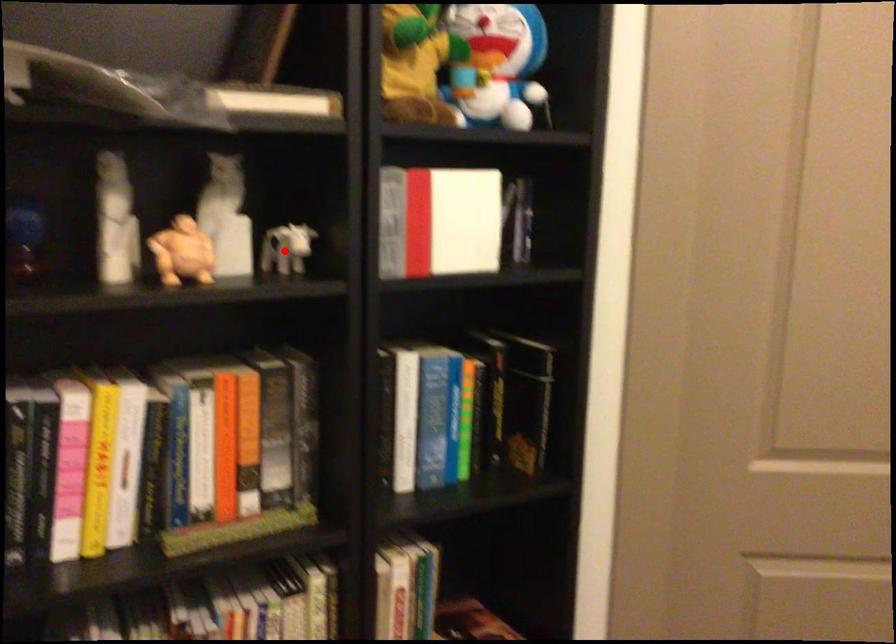
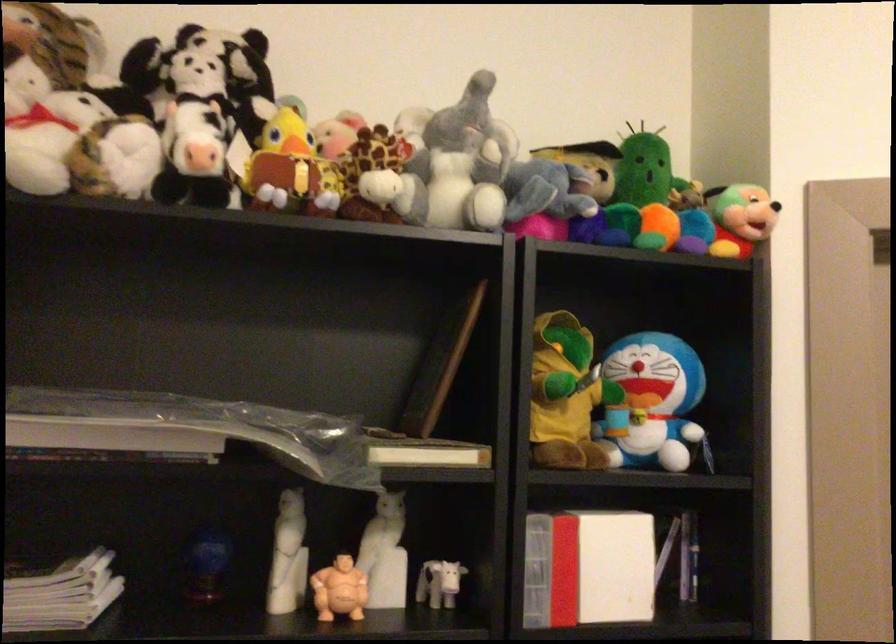
The point at the highlighted location is marked in the first image. Where is the corresponding point in the second image?

(438, 583)